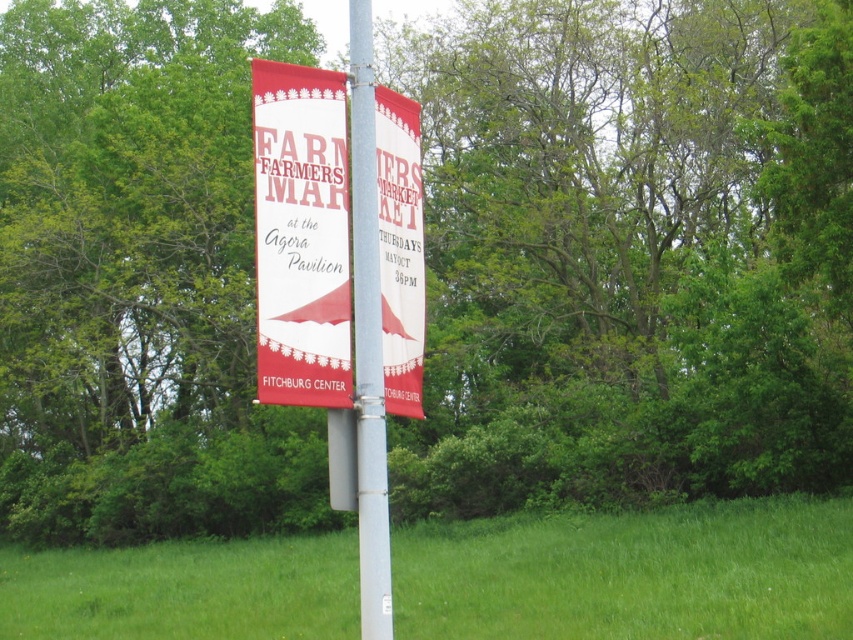
Question: Which point is closer to the camera taking this photo?

Choices:
 (A) (384, 304)
 (B) (369, 374)

Answer: (B)

Question: Considering the relative positions of green grass at center and metallic silver pole at center in the image provided, where is green grass at center located with respect to metallic silver pole at center?

Choices:
 (A) below
 (B) above

Answer: (A)

Question: Which object appears farthest from the camera in this image?

Choices:
 (A) matte white banner at center
 (B) green grass at center
 (C) metallic silver pole at center

Answer: (B)

Question: Does green grass at center have a greater width compared to matte white banner at center?

Choices:
 (A) no
 (B) yes

Answer: (B)

Question: Is matte white banner at center closer to camera compared to metallic silver pole at center?

Choices:
 (A) no
 (B) yes

Answer: (A)

Question: Which object is closer to the camera taking this photo?

Choices:
 (A) metallic silver pole at center
 (B) green grass at center
 (C) matte white banner at center

Answer: (A)